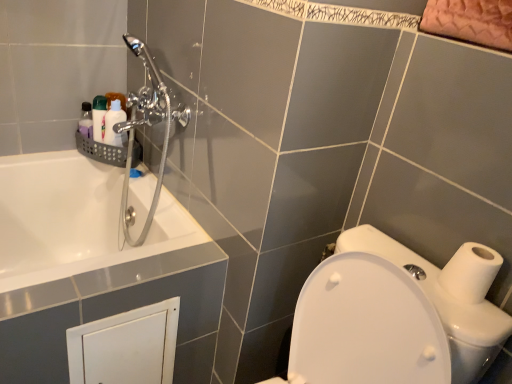
Question: Is the position of chrome metallic shower head at upper left less distant than that of white glossy bottle at upper left, which ranks as the first toiletry in right-to-left order?

Choices:
 (A) no
 (B) yes

Answer: (B)

Question: Is the position of chrome metallic shower head at upper left more distant than that of white glossy bottle at upper left, which ranks as the first toiletry in right-to-left order?

Choices:
 (A) no
 (B) yes

Answer: (A)

Question: From the image's perspective, is chrome metallic shower head at upper left under white glossy bottle at upper left, which ranks as the first toiletry in right-to-left order?

Choices:
 (A) yes
 (B) no

Answer: (A)

Question: Is chrome metallic shower head at upper left surrounding white glossy bottle at upper left, which ranks as the first toiletry in right-to-left order?

Choices:
 (A) yes
 (B) no

Answer: (B)

Question: Can you confirm if chrome metallic shower head at upper left is wider than white glossy bottle at upper left, which ranks as the first toiletry in right-to-left order?

Choices:
 (A) no
 (B) yes

Answer: (B)

Question: Considering the positions of translucent plastic soap at upper left, the first toiletry positioned from the left, and chrome metallic shower head at upper left in the image, is translucent plastic soap at upper left, the first toiletry positioned from the left, bigger or smaller than chrome metallic shower head at upper left?

Choices:
 (A) big
 (B) small

Answer: (B)

Question: From the image's perspective, is translucent plastic soap at upper left, the first toiletry positioned from the left, located above or below chrome metallic shower head at upper left?

Choices:
 (A) above
 (B) below

Answer: (A)

Question: Looking at their shapes, would you say translucent plastic soap at upper left, the second toiletry viewed from the right, is wider or thinner than chrome metallic shower head at upper left?

Choices:
 (A) wide
 (B) thin

Answer: (B)

Question: Is point (96, 119) closer or farther from the camera than point (158, 94)?

Choices:
 (A) closer
 (B) farther

Answer: (B)

Question: In terms of size, does white glossy bottle at upper left, which appears as the second toiletry when viewed from the left, appear bigger or smaller than white matte toilet paper at right?

Choices:
 (A) small
 (B) big

Answer: (B)

Question: Considering their positions, is white glossy bottle at upper left, which ranks as the first toiletry in right-to-left order, located in front of or behind white matte toilet paper at right?

Choices:
 (A) front
 (B) behind

Answer: (B)

Question: From the image's perspective, is white glossy bottle at upper left, which appears as the second toiletry when viewed from the left, positioned above or below white matte toilet paper at right?

Choices:
 (A) above
 (B) below

Answer: (A)

Question: Which is correct: white glossy bottle at upper left, which appears as the second toiletry when viewed from the left, is inside white matte toilet paper at right, or outside of it?

Choices:
 (A) outside
 (B) inside

Answer: (A)

Question: From a real-world perspective, is translucent plastic soap at upper left, the second toiletry viewed from the right, physically located above or below white glossy toilet at lower right?

Choices:
 (A) below
 (B) above

Answer: (B)

Question: In terms of height, does translucent plastic soap at upper left, the first toiletry positioned from the left, look taller or shorter compared to white glossy toilet at lower right?

Choices:
 (A) short
 (B) tall

Answer: (A)